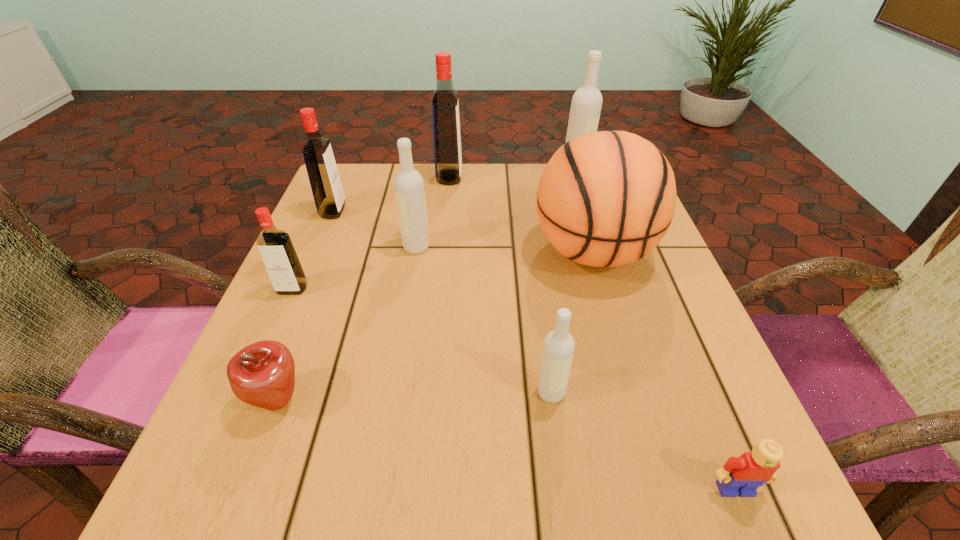
I want to click on the farthest red vodka, so point(445,107).

Where is `the biggest red vodka`? the biggest red vodka is located at coordinates (445, 107).

In order to click on the rightmost vodka in this screenshot , I will do `click(586, 104)`.

Find the location of `the rightmost white vodka`. the rightmost white vodka is located at coordinates (586, 104).

You are a GUI agent. You are given a task and a screenshot of the screen. Output one action in this format:
    pyautogui.click(x=<x>, y=<y>)
    Task: Click on the basketball
    
    Given the screenshot: What is the action you would take?
    pyautogui.click(x=605, y=199)

Where is `the second smallest red vodka`? This screenshot has height=540, width=960. the second smallest red vodka is located at coordinates (327, 190).

Where is `the fourth nearest vodka`? the fourth nearest vodka is located at coordinates (327, 190).

This screenshot has width=960, height=540. What are the coordinates of `the second nearest white vodka` in the screenshot? It's located at (408, 183).

The width and height of the screenshot is (960, 540). I want to click on the leftmost white vodka, so click(408, 183).

The height and width of the screenshot is (540, 960). I want to click on the smallest red vodka, so click(x=280, y=259).